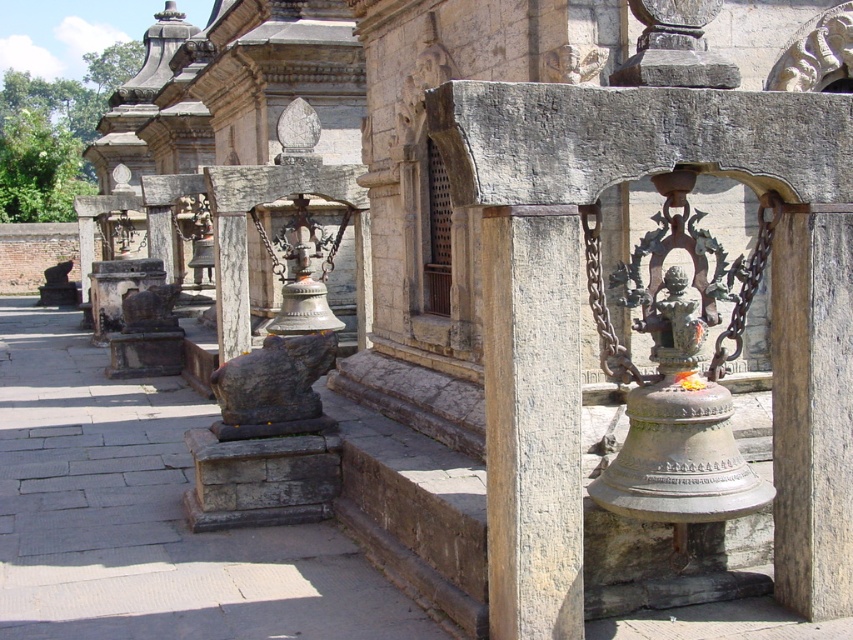
Who is more forward, (489, 516) or (294, 340)?

Point (489, 516) is in front.

The image size is (853, 640). Describe the element at coordinates (532, 420) in the screenshot. I see `brown stone pillar at center` at that location.

Between point (500, 356) and point (323, 337), which one is positioned behind?

The point (323, 337) is more distant.

Locate an element on the screen. The image size is (853, 640). brown stone pillar at center is located at coordinates (532, 420).